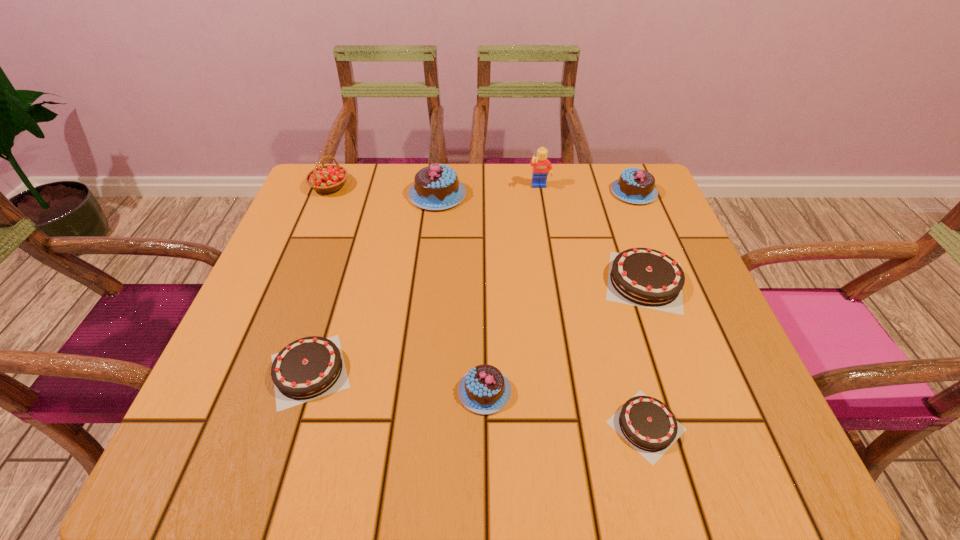
Locate an element on the screen. the second shortest object is located at coordinates (311, 367).

At what (x,y) coordinates should I click in order to perform the action: click on the smallest brown chocolate cake. Please return your answer as a coordinate pair (x, y). Looking at the image, I should click on (646, 423).

Locate an element on the screen. The image size is (960, 540). the shortest chocolate cake is located at coordinates (646, 423).

This screenshot has width=960, height=540. I want to click on vacant space located 0.160m on the face of the fifth object from left to right, so coord(547,232).

You are a GUI agent. You are given a task and a screenshot of the screen. Output one action in this format:
    pyautogui.click(x=<x>, y=<y>)
    Task: Click on the free location located on the right of the brown strawberry
    Image resolution: width=960 pixels, height=540 pixels.
    Given the screenshot: What is the action you would take?
    pyautogui.click(x=493, y=186)

The height and width of the screenshot is (540, 960). Find the location of `vacant space located 0.240m on the front of the tallest chocolate cake`. vacant space located 0.240m on the front of the tallest chocolate cake is located at coordinates (427, 284).

At what (x,y) coordinates should I click in order to perform the action: click on free space located on the left of the fourth tallest object. Please return your answer as a coordinate pair (x, y). The width and height of the screenshot is (960, 540). Looking at the image, I should click on (489, 192).

Locate an element on the screen. free space located on the back of the fourth nearest chocolate cake is located at coordinates (604, 167).

The image size is (960, 540). Find the location of `blank space located on the right of the smallest pink chocolate cake`. blank space located on the right of the smallest pink chocolate cake is located at coordinates (599, 391).

Where is `vacant space located 0.250m on the right of the leftmost chocolate cake`? This screenshot has width=960, height=540. vacant space located 0.250m on the right of the leftmost chocolate cake is located at coordinates (495, 370).